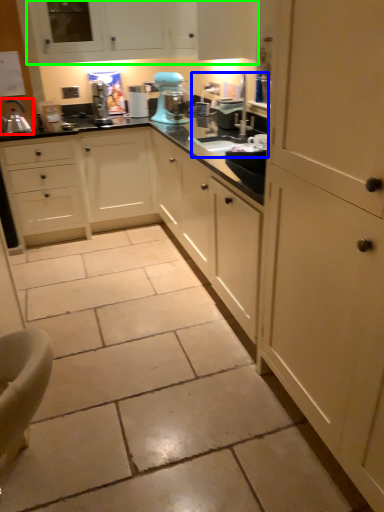
Question: Considering the real-world distances, which object is closest to kitchen appliance (highlighted by a red box)? sink (highlighted by a blue box) or cabinetry (highlighted by a green box).

Choices:
 (A) sink
 (B) cabinetry

Answer: (B)